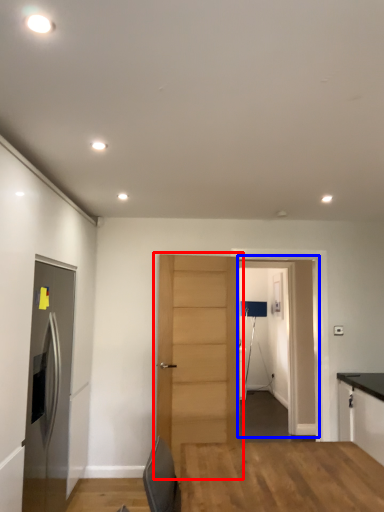
Question: Which of the following is the farthest to the observer, door (highlighted by a red box) or glass door (highlighted by a blue box)?

Choices:
 (A) door
 (B) glass door

Answer: (B)